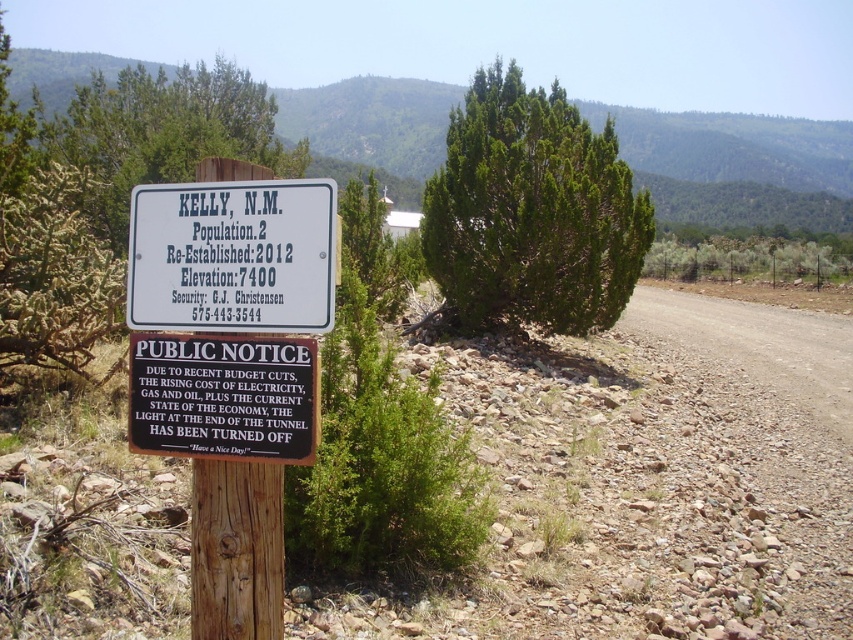
Based on the photo, is white plastic sign at center taller than wooden post at center?

In fact, white plastic sign at center may be shorter than wooden post at center.

Is the position of white plastic sign at center more distant than that of wooden post at center?

No, white plastic sign at center is in front of wooden post at center.

Which is behind, point (281, 294) or point (230, 515)?

Point (230, 515)

The width and height of the screenshot is (853, 640). What are the coordinates of `white plastic sign at center` in the screenshot? It's located at (231, 257).

Is the position of brown gravel road at right less distant than that of brown wooden sign at lower left?

No.

Between point (646, 285) and point (286, 456), which one is positioned behind?

Point (646, 285)

This screenshot has height=640, width=853. What are the coordinates of `brown gravel road at right` in the screenshot? It's located at (775, 426).

Who is higher up, brown wooden sign at lower left or wooden post at center?

Positioned higher is brown wooden sign at lower left.

Who is positioned more to the right, brown wooden sign at lower left or wooden post at center?

wooden post at center

Who is more forward, (314, 352) or (241, 625)?

Point (314, 352) is more forward.

Where is `brown wooden sign at lower left`? Image resolution: width=853 pixels, height=640 pixels. brown wooden sign at lower left is located at coordinates (223, 396).